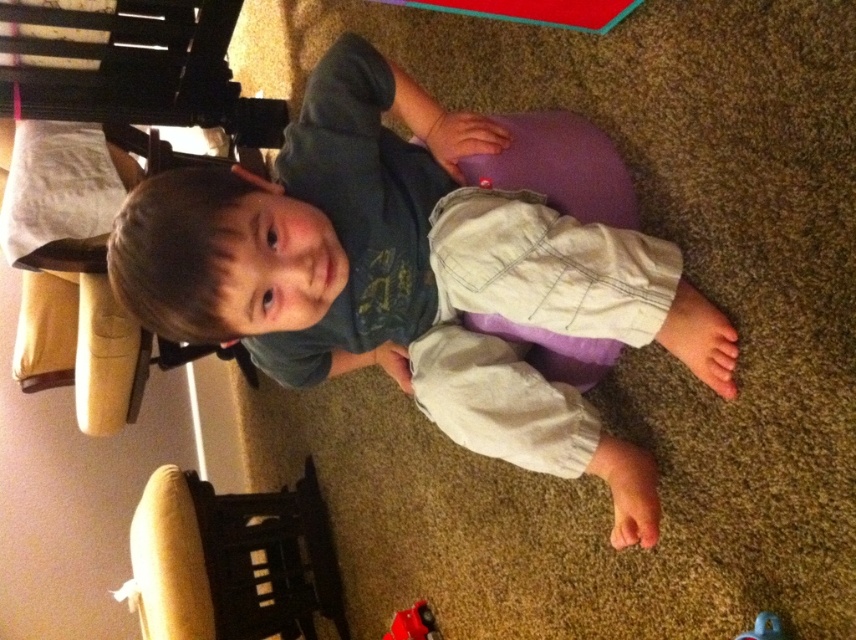
Question: Which of the following is the closest to the observer?

Choices:
 (A) (622, 448)
 (B) (134, 552)
 (C) (756, 618)

Answer: (C)

Question: Considering the relative positions of matte gray shirt at center and velvet beige bean bag chair at left in the image provided, where is matte gray shirt at center located with respect to velvet beige bean bag chair at left?

Choices:
 (A) right
 (B) left

Answer: (A)

Question: Which object is the farthest from the matte gray shirt at center?

Choices:
 (A) rubberized red toy car at lower center
 (B) blue rubber duck at lower right
 (C) velvet beige bean bag chair at left

Answer: (C)

Question: Estimate the real-world distances between objects in this image. Which object is closer to the matte gray shirt at center?

Choices:
 (A) rubberized red toy car at lower center
 (B) blue rubber duck at lower right

Answer: (B)

Question: Is matte gray shirt at center wider than blue rubber duck at lower right?

Choices:
 (A) no
 (B) yes

Answer: (B)

Question: From the image, what is the correct spatial relationship of matte gray shirt at center in relation to velvet beige bean bag chair at left?

Choices:
 (A) right
 (B) left

Answer: (A)